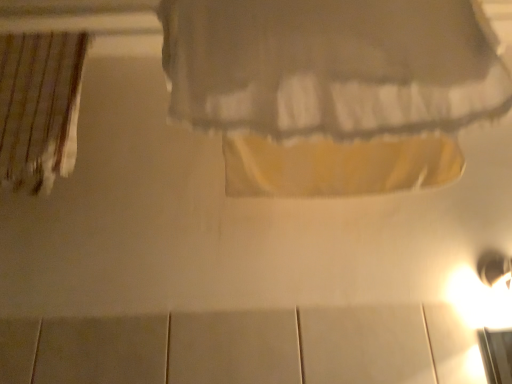
Question: Is striped fabric curtain at left, the first curtain positioned from the back, to the right of matte white curtain at upper center, acting as the 2th curtain starting from the back, from the viewer's perspective?

Choices:
 (A) yes
 (B) no

Answer: (B)

Question: Considering the relative sizes of striped fabric curtain at left, the second curtain in the front-to-back sequence, and matte white curtain at upper center, which is the 1th curtain from right to left, in the image provided, is striped fabric curtain at left, the second curtain in the front-to-back sequence, thinner than matte white curtain at upper center, which is the 1th curtain from right to left,?

Choices:
 (A) no
 (B) yes

Answer: (B)

Question: From the image's perspective, is striped fabric curtain at left, the first curtain positioned from the back, above matte white curtain at upper center, acting as the 2th curtain starting from the back?

Choices:
 (A) yes
 (B) no

Answer: (B)

Question: From a real-world perspective, is striped fabric curtain at left, the first curtain positioned from the back, positioned over matte white curtain at upper center, acting as the 2th curtain starting from the back, based on gravity?

Choices:
 (A) no
 (B) yes

Answer: (B)

Question: Does striped fabric curtain at left, the second curtain in the front-to-back sequence, have a greater height compared to matte white curtain at upper center, acting as the 2th curtain starting from the back?

Choices:
 (A) yes
 (B) no

Answer: (A)

Question: Are striped fabric curtain at left, marked as the second curtain in a right-to-left arrangement, and matte white curtain at upper center, acting as the 2th curtain starting from the back, beside each other?

Choices:
 (A) no
 (B) yes

Answer: (A)

Question: Does matte white curtain at upper center, which is the 1th curtain from right to left, touch striped fabric curtain at left, the first curtain positioned from the back?

Choices:
 (A) yes
 (B) no

Answer: (B)

Question: Is matte white curtain at upper center, the second curtain positioned from the left, smaller than striped fabric curtain at left, marked as the second curtain in a right-to-left arrangement?

Choices:
 (A) yes
 (B) no

Answer: (B)

Question: Would you say striped fabric curtain at left, the 1th curtain from the left, is part of matte white curtain at upper center, the second curtain positioned from the left,'s contents?

Choices:
 (A) yes
 (B) no

Answer: (B)

Question: Is matte white curtain at upper center, the second curtain positioned from the left, completely or partially outside of striped fabric curtain at left, the second curtain in the front-to-back sequence?

Choices:
 (A) yes
 (B) no

Answer: (A)

Question: From the image's perspective, would you say matte white curtain at upper center, the second curtain positioned from the left, is shown under striped fabric curtain at left, the second curtain in the front-to-back sequence?

Choices:
 (A) yes
 (B) no

Answer: (B)

Question: From the image's perspective, is matte white curtain at upper center, the second curtain positioned from the left, located above striped fabric curtain at left, the 1th curtain from the left?

Choices:
 (A) no
 (B) yes

Answer: (B)

Question: Does point (45, 119) appear closer or farther from the camera than point (222, 41)?

Choices:
 (A) closer
 (B) farther

Answer: (B)